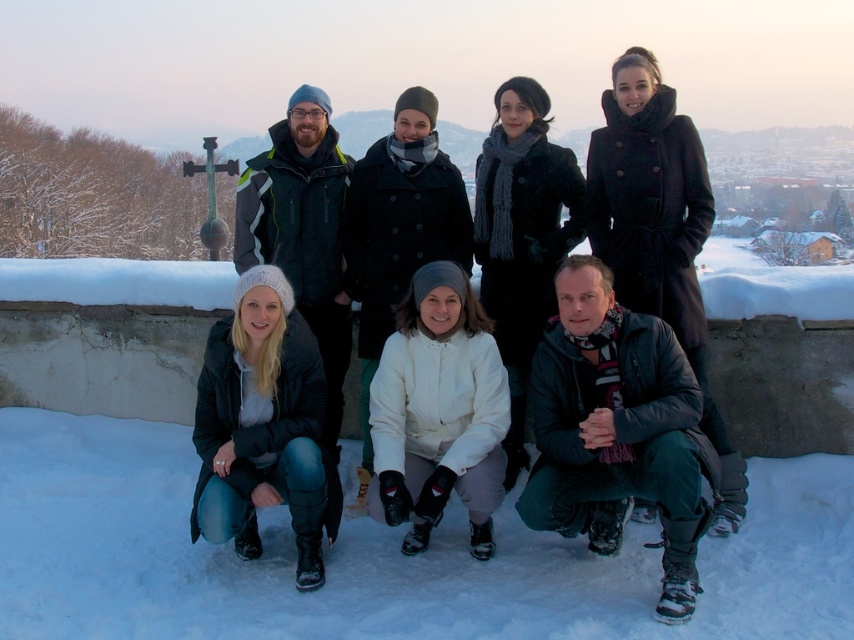
Question: Does matte black jacket at lower left appear on the right side of white matte jacket at center?

Choices:
 (A) no
 (B) yes

Answer: (A)

Question: Which point appears farthest from the camera in this image?

Choices:
 (A) (439, 433)
 (B) (279, 486)
 (C) (607, 497)

Answer: (A)

Question: Is white fluffy snow at lower center to the right of matte black jacket at lower left from the viewer's perspective?

Choices:
 (A) no
 (B) yes

Answer: (B)

Question: Among these points, which one is farthest from the camera?

Choices:
 (A) (616, 84)
 (B) (562, 554)
 (C) (266, 440)

Answer: (A)

Question: Is matte black jacket at lower left in front of white matte jacket at center?

Choices:
 (A) yes
 (B) no

Answer: (A)

Question: Which object is farther from the camera taking this photo?

Choices:
 (A) white matte jacket at center
 (B) matte black jacket at lower left
 (C) white fluffy snow at lower center
 (D) matte black coat at center

Answer: (A)